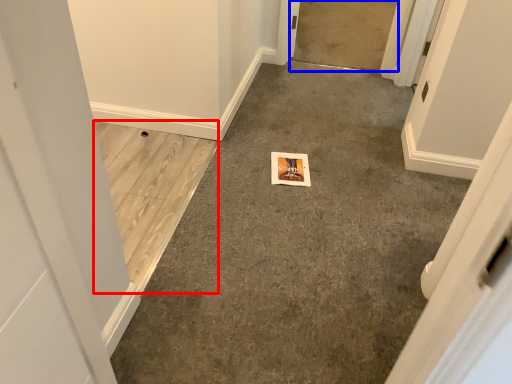
Question: Among these objects, which one is farthest to the camera, concrete (highlighted by a red box) or concrete (highlighted by a blue box)?

Choices:
 (A) concrete
 (B) concrete

Answer: (B)